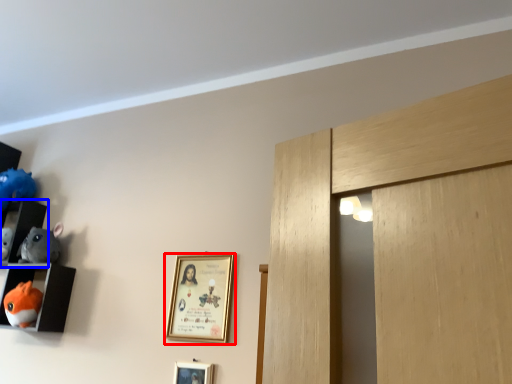
Question: Which point is closer to the camera, picture frame (highlighted by a red box) or shelf (highlighted by a blue box)?

Choices:
 (A) picture frame
 (B) shelf

Answer: (A)